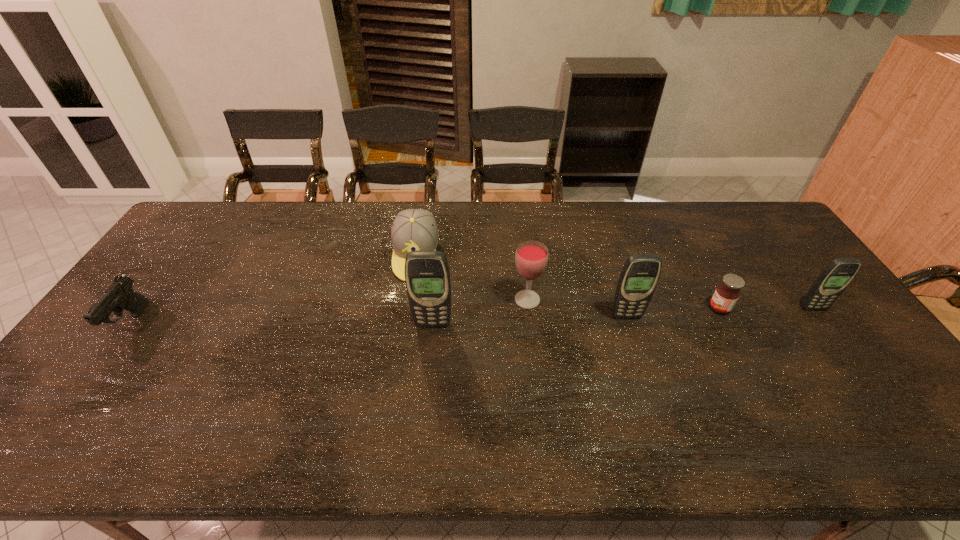
Please point a vacant point for placing a cellular telephone on the left. Please provide its 2D coordinates. Your answer should be formatted as a tuple, i.e. [(x, y)], where the tuple contains the x and y coordinates of a point satisfying the conditions above.

[(232, 333)]